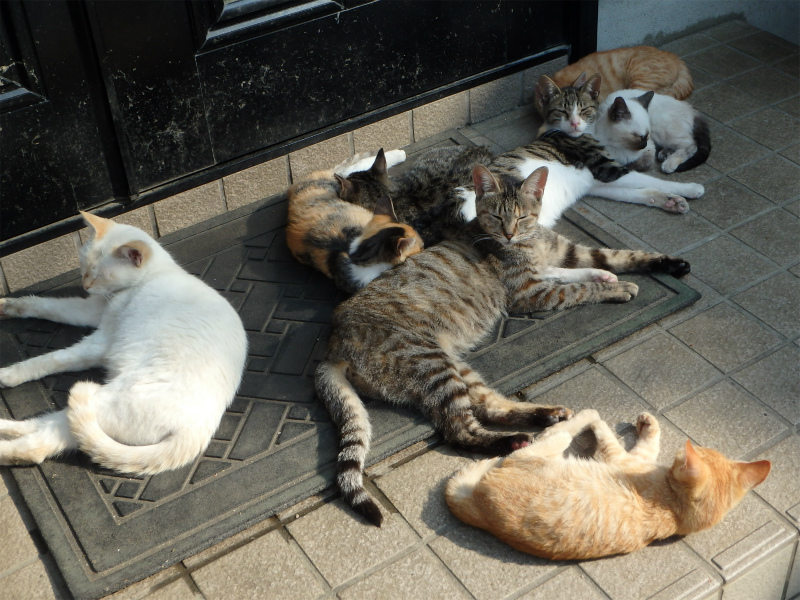
In order to click on rubber mat in this screenshot , I will do `click(236, 481)`.